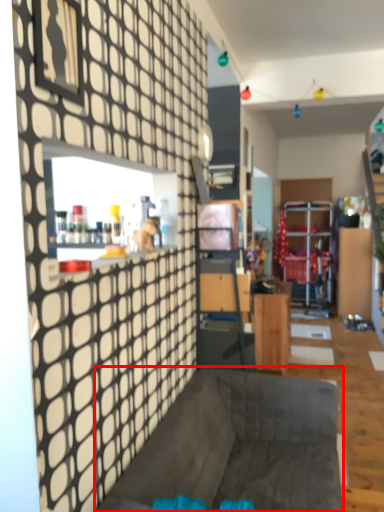
Question: From the image, what is the correct spatial relationship of furniture (annotated by the red box) in relation to table?

Choices:
 (A) left
 (B) right

Answer: (A)